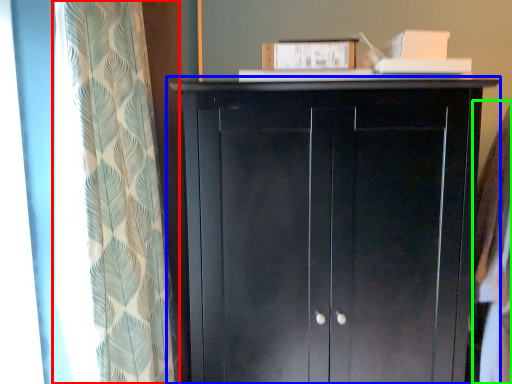
Question: Which object is the farthest from curtain (highlighted by a red box)? Choose among these: cupboard (highlighted by a blue box) or clothing (highlighted by a green box).

Choices:
 (A) cupboard
 (B) clothing

Answer: (B)